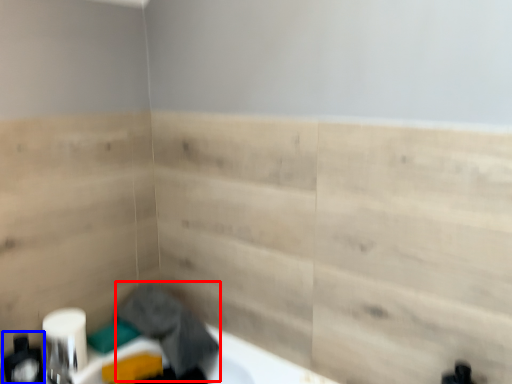
Question: Which object is further to the camera taking this photo, laundry (highlighted by a red box) or toiletry (highlighted by a blue box)?

Choices:
 (A) laundry
 (B) toiletry

Answer: (A)